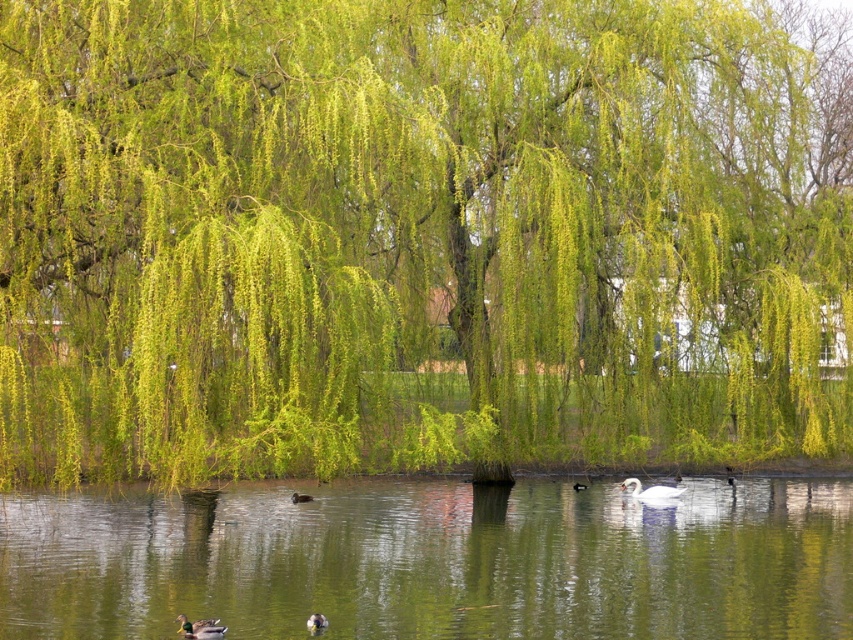
You are standing on the lakeside and want to throw a pebble into the green reflective water at center. If you can throw the pebble 15 meters, will it reach the water?

The distance between you and the green reflective water at center is 17.06 meters. Since your throw can only reach 15 meters, the pebble will not reach the water.

You are standing at the lakeside and want to take a photo of both point (200, 620) and point (637, 492). Which point should you focus on first to ensure both are in clear view?

You should focus on point (200, 620) first because it is closer to the camera than point (637, 492). By focusing on the closer point, the depth of field may also keep the farther point in acceptable focus.